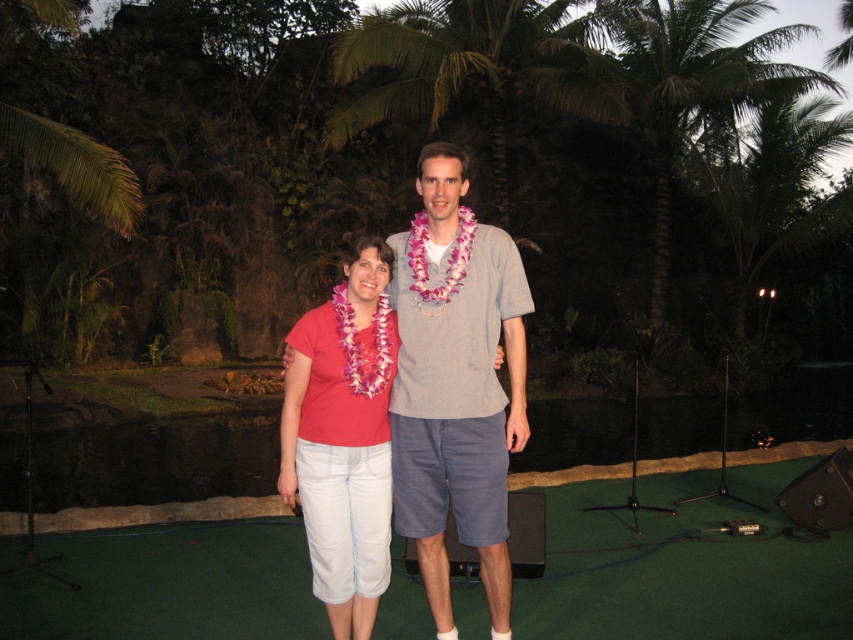
At what (x,y) coordinates should I click in order to perform the action: click on green turf at center. Please return your answer as a coordinate pair (x, y). This screenshot has width=853, height=640. Looking at the image, I should click on (685, 570).

Does point (48, 582) come behind point (424, 584)?

Yes, point (48, 582) is behind point (424, 584).

At what (x,y) coordinates should I click in order to perform the action: click on green turf at center. Please return your answer as a coordinate pair (x, y). Looking at the image, I should click on (685, 570).

You are a GUI agent. You are given a task and a screenshot of the screen. Output one action in this format:
    pyautogui.click(x=<x>, y=<y>)
    Task: Click on the green turf at center
    The width and height of the screenshot is (853, 640).
    Given the screenshot: What is the action you would take?
    pyautogui.click(x=685, y=570)

Can you confirm if matte pink shirt at center is shorter than green leafy palm tree at upper center?

Incorrect, matte pink shirt at center's height does not fall short of green leafy palm tree at upper center's.

Identify the location of matte pink shirt at center. (343, 436).

The image size is (853, 640). I want to click on matte pink shirt at center, so click(343, 436).

The height and width of the screenshot is (640, 853). What are the coordinates of `matte pink shirt at center` in the screenshot? It's located at (343, 436).